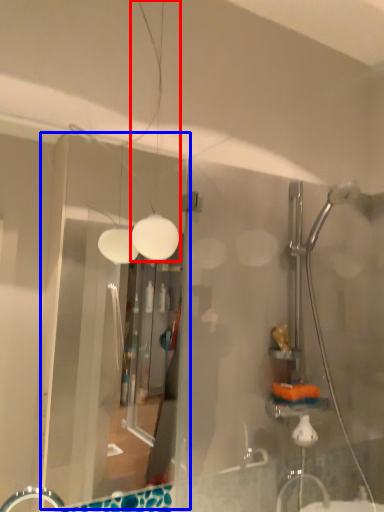
Question: Which point is further to the camera, light fixture (highlighted by a red box) or glass door (highlighted by a blue box)?

Choices:
 (A) light fixture
 (B) glass door

Answer: (A)